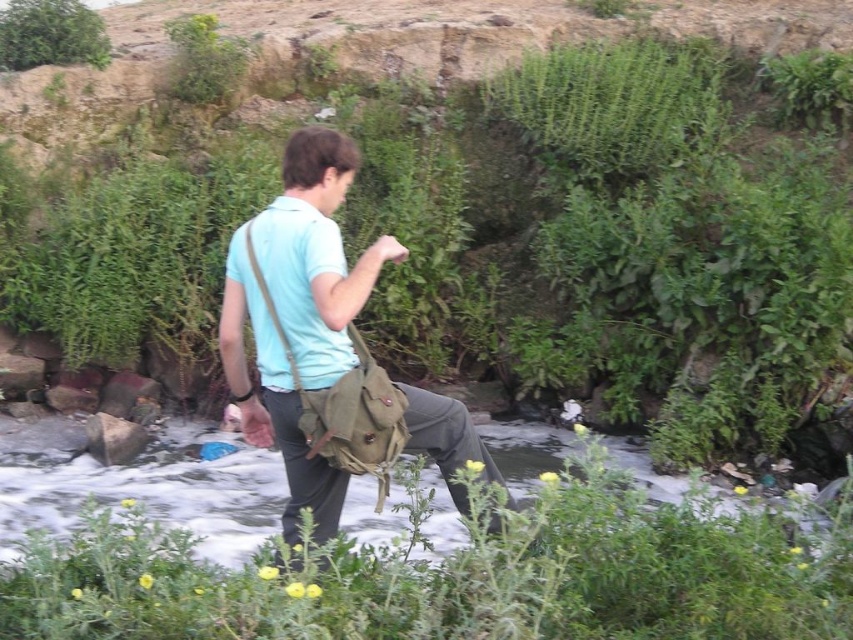
You are a hiker who wants to cross the stream safely. You notice the light blue cotton shirt at center and the green leafy bush at upper left. Which object is more suitable to use as a makeshift rope for securing your footing?

The green leafy bush at upper left is thicker than the light blue cotton shirt at center, so it would be more suitable as a makeshift rope for securing your footing.

You are a hiker planning to cross the stream in the scene. You notice the green leafy plant at center and the green leafy bush at upper left. Which of these two plants has a wider spread?

The green leafy plant at center has a wider spread than the green leafy bush at upper left because its width is larger according to the description.